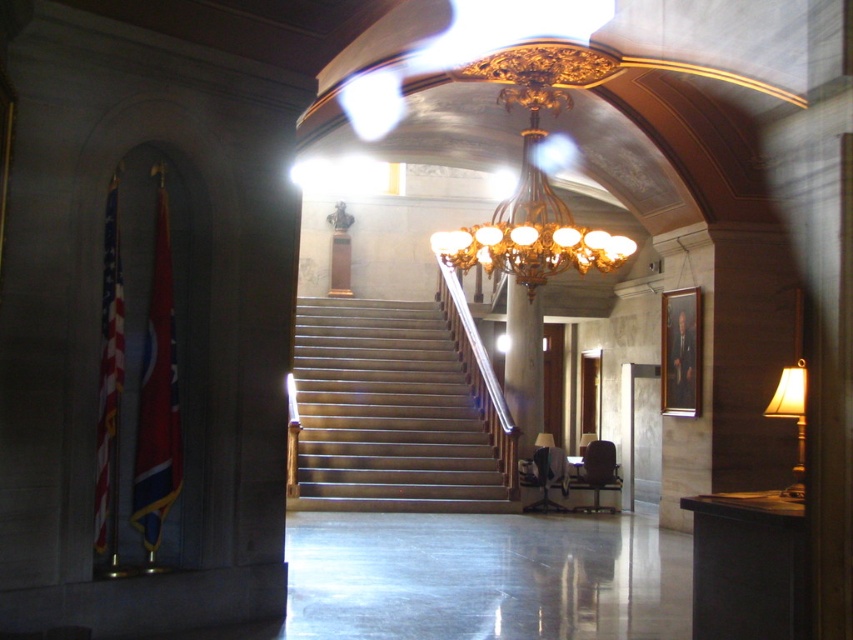
Is polished wood stairs at center thinner than gold/gilded chandelier at center?

Yes, polished wood stairs at center is thinner than gold/gilded chandelier at center.

Who is more distant from viewer, (369,301) or (581,243)?

Point (369,301)

The width and height of the screenshot is (853, 640). I want to click on polished wood stairs at center, so click(390, 413).

Measure the distance from polished wood stairs at center to matte gold lampshade at right.

polished wood stairs at center and matte gold lampshade at right are 9.10 meters apart from each other.

Who is lower down, polished wood stairs at center or matte gold lampshade at right?

polished wood stairs at center is lower down.

Describe the element at coordinates (390, 413) in the screenshot. I see `polished wood stairs at center` at that location.

Where is `polished wood stairs at center`? This screenshot has height=640, width=853. polished wood stairs at center is located at coordinates (390, 413).

Is point (456, 236) positioned after point (804, 381)?

That is True.

Consider the image. Does gold/gilded chandelier at center have a greater width compared to matte gold lampshade at right?

Indeed, gold/gilded chandelier at center has a greater width compared to matte gold lampshade at right.

The image size is (853, 640). I want to click on gold/gilded chandelier at center, so click(x=532, y=212).